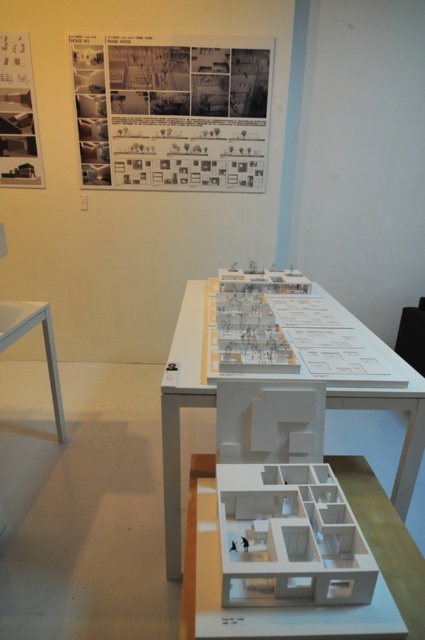
Question: Is black paper at upper center wider than white matte model at center?

Choices:
 (A) yes
 (B) no

Answer: (A)

Question: Can you confirm if white matte model house at center is thinner than white paper poster at upper left?

Choices:
 (A) yes
 (B) no

Answer: (B)

Question: Does white matte model at center appear under white paper poster at upper left?

Choices:
 (A) yes
 (B) no

Answer: (A)

Question: Which point is farther from the camera taking this photo?

Choices:
 (A) (0, 173)
 (B) (401, 611)

Answer: (A)

Question: Which of the following is the closest to the observer?

Choices:
 (A) black paper at upper center
 (B) white paper poster at upper left

Answer: (A)

Question: Which of the following is the farthest from the observer?

Choices:
 (A) (x=53, y=339)
 (B) (x=178, y=550)
 (C) (x=25, y=49)
 (D) (x=198, y=547)

Answer: (C)